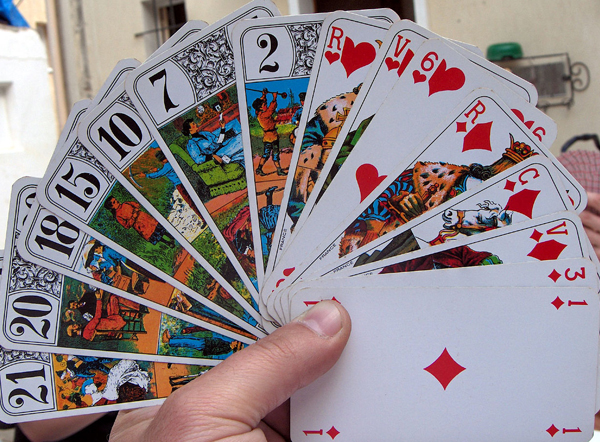
Where is `wall`? The width and height of the screenshot is (600, 442). wall is located at coordinates (535, 17), (36, 96).